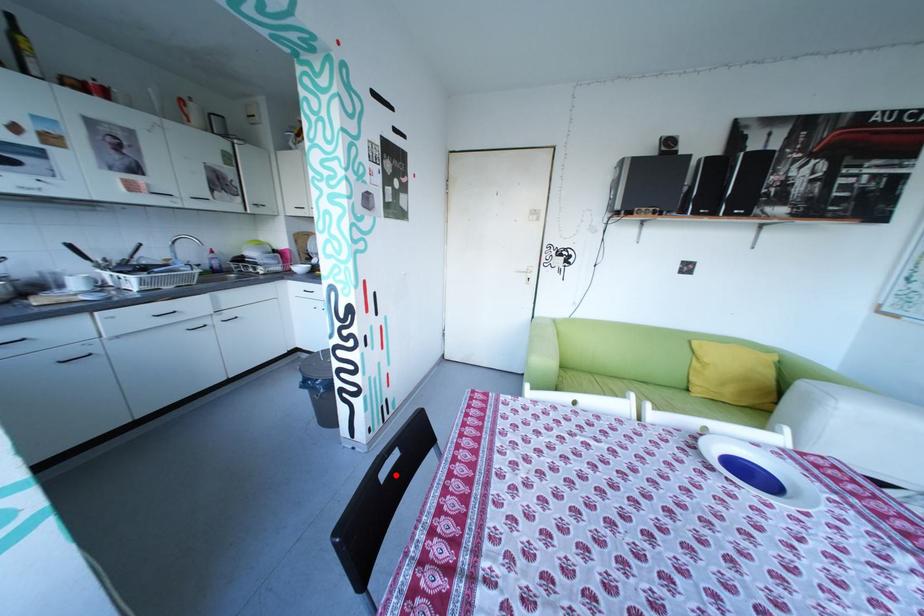
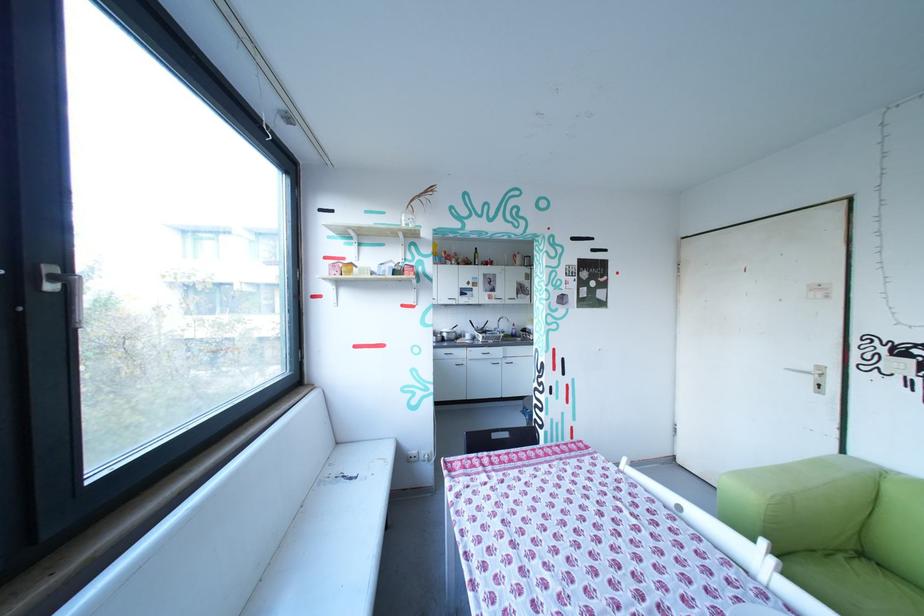
Question: I am providing you with two images of the same scene from different viewpoints. A red point is shown in image1. For the corresponding object point in image2, is it positioned nearer or farther from the camera?

Choices:
 (A) Nearer
 (B) Farther

Answer: (A)